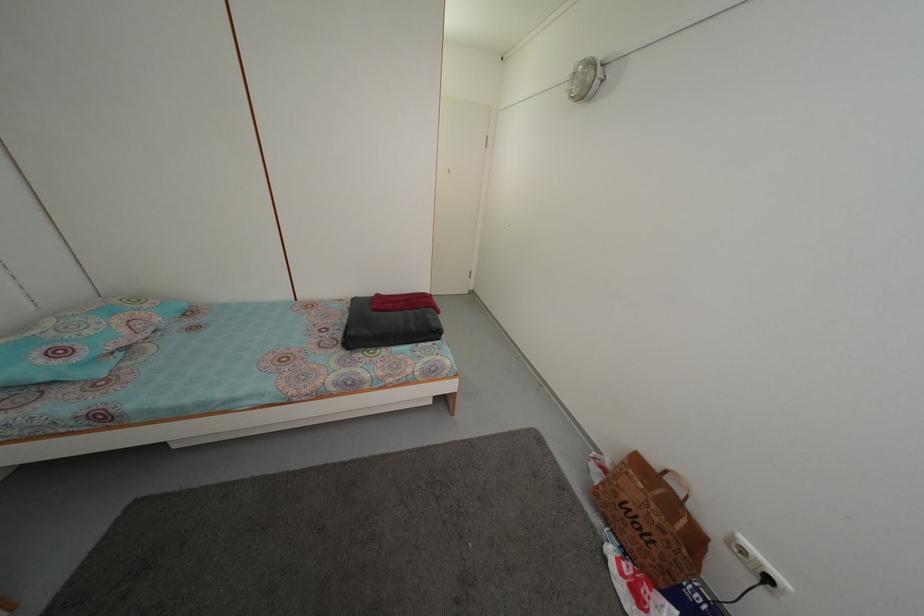
This screenshot has width=924, height=616. Find the location of `paper bag handle`. paper bag handle is located at coordinates (677, 483).